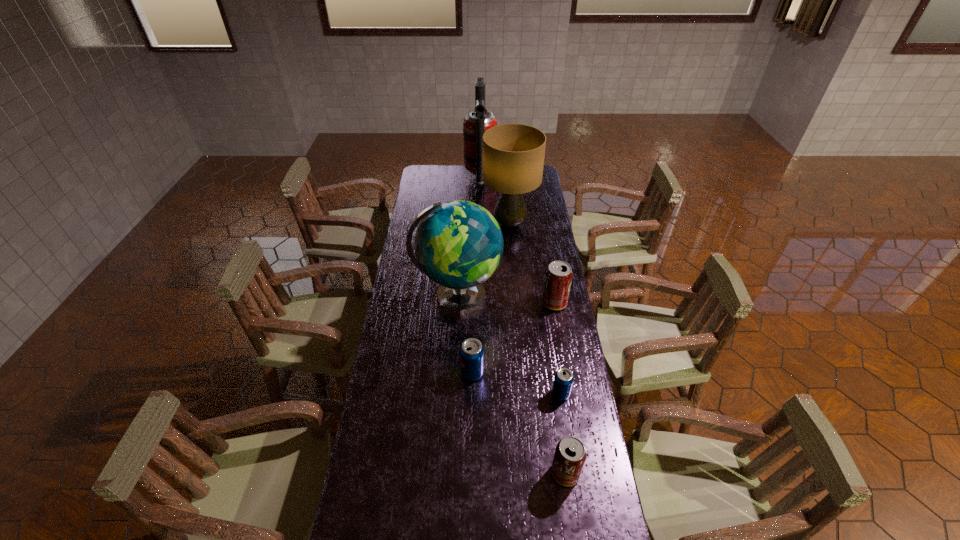
You are a GUI agent. You are given a task and a screenshot of the screen. Output one action in this format:
    pyautogui.click(x=<x>, y=<y>)
    Task: Click on the free space located on the back of the nearest pop soda
    This screenshot has height=540, width=960.
    Given the screenshot: What is the action you would take?
    pyautogui.click(x=550, y=365)

Identify the location of vacant space located 0.300m on the left of the shortest pop soda. (465, 394).

Identify the location of object located in the far edge section of the desktop. (478, 121).

The image size is (960, 540). Find the location of `object at the left edge`. object at the left edge is located at coordinates (458, 244).

Locate an element on the screen. lampshade situated at the right edge is located at coordinates (513, 154).

This screenshot has width=960, height=540. Identify the location of free region at the left edge of the desktop. (431, 312).

In the image, there is a desktop. Where is `vacant space at the right edge`? This screenshot has height=540, width=960. vacant space at the right edge is located at coordinates (564, 416).

Where is `free area in between the bigger blue pop soda and the nearer red soda can`? free area in between the bigger blue pop soda and the nearer red soda can is located at coordinates (518, 423).

At what (x,y) coordinates should I click in order to perform the action: click on empty location between the farthest object and the tallest pop soda. Please return your answer as a coordinate pair (x, y). Looking at the image, I should click on (517, 241).

At what (x,y) coordinates should I click in order to perform the action: click on free point between the shortest pop soda and the blue globe. Please return your answer as a coordinate pair (x, y). Looking at the image, I should click on (509, 346).